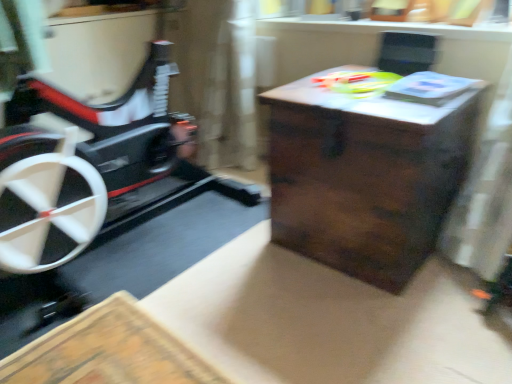
The width and height of the screenshot is (512, 384). Identify the location of vacant region below translucent plastic toy at upper center (from a real-world perspective). (343, 88).